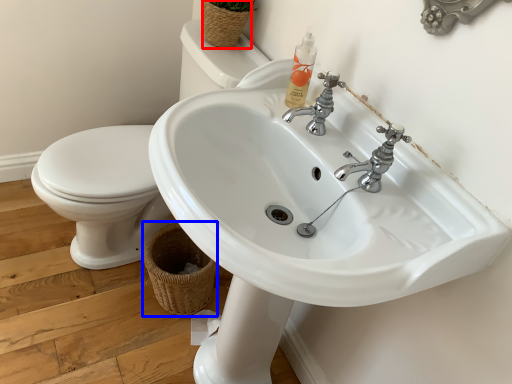
Question: Which point is further to the camera, basket (highlighted by a red box) or basket (highlighted by a blue box)?

Choices:
 (A) basket
 (B) basket

Answer: (B)